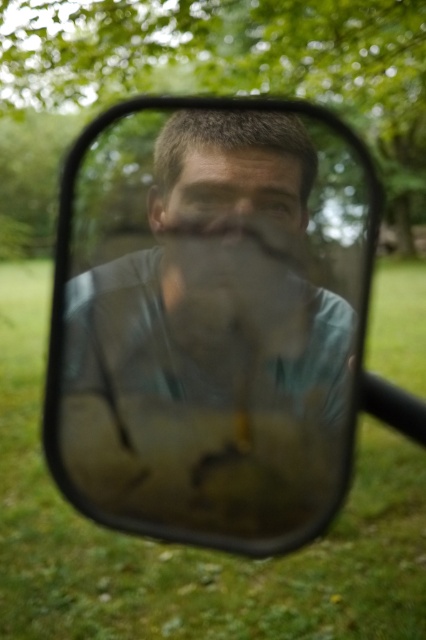
You are driving a car and notice the green leafy tree at upper center and the smooth skin face at center in your side mirror. Which object is farther from your current position?

The green leafy tree at upper center is farther from your current position than the smooth skin face at center because it is 3.89 meters away from the smooth skin face at center, implying it is further back.

You are driving a car and need to check your side mirror to see if there is space to safely change lanes. The clear glass mirror at center is positioned at coordinates 0.500, 0.495. Can you determine if the mirror is correctly positioned for a proper lane change check?

The clear glass mirror at center is positioned at point (x=210, y=320), which is the recommended position for optimal lane change visibility. Therefore, the mirror is correctly positioned for a proper lane change check.